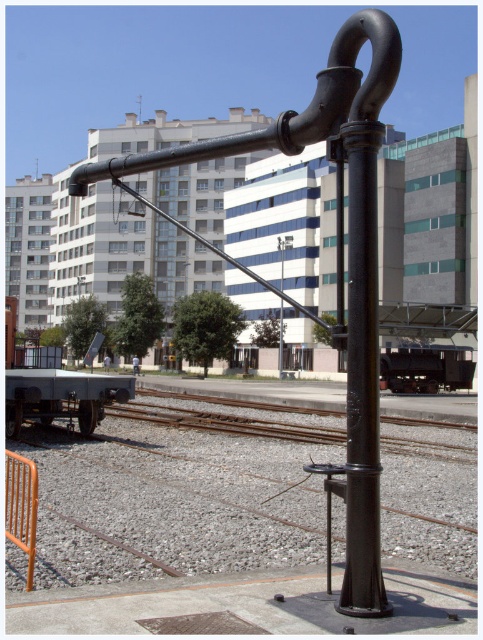
Question: Does black matte pipe at center have a smaller size compared to black metal lamp post at center?

Choices:
 (A) no
 (B) yes

Answer: (A)

Question: From the image, what is the correct spatial relationship of black matte pipe at center in relation to black metal lamp post at center?

Choices:
 (A) below
 (B) above

Answer: (B)

Question: Among these points, which one is farthest from the camera?

Choices:
 (A) pyautogui.click(x=28, y=458)
 (B) pyautogui.click(x=365, y=40)

Answer: (A)

Question: Is orange metallic rail at lower left closer to the viewer compared to black metal lamp post at center?

Choices:
 (A) yes
 (B) no

Answer: (A)

Question: Which of the following is the farthest from the observer?

Choices:
 (A) (321, 138)
 (B) (287, 300)

Answer: (A)

Question: Which point is farther to the camera?

Choices:
 (A) black matte pipe at center
 (B) black metal lamp post at center
 (C) orange metallic rail at lower left

Answer: (B)